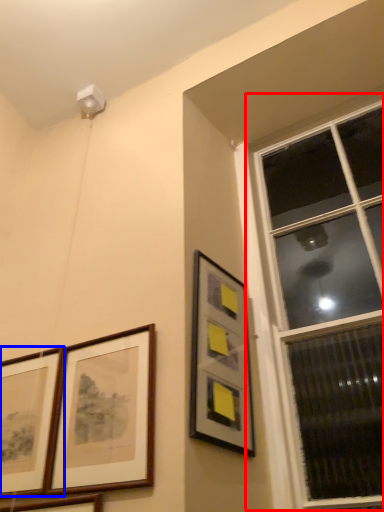
Question: Which point is closer to the camera, window (highlighted by a red box) or picture frame (highlighted by a blue box)?

Choices:
 (A) window
 (B) picture frame

Answer: (A)